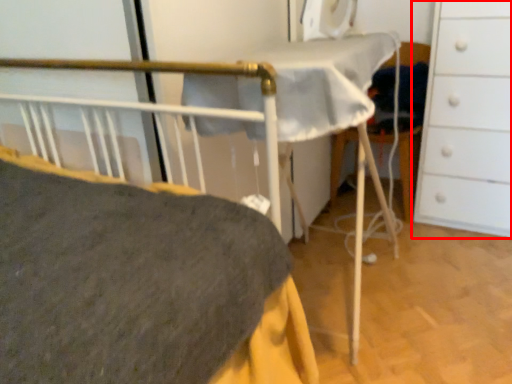
Question: From the image's perspective, what is the correct spatial positioning of chest of drawers (annotated by the red box) in reference to folding chair?

Choices:
 (A) below
 (B) above

Answer: (B)